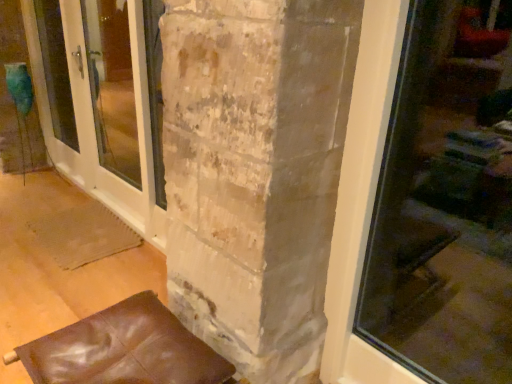
Question: In terms of height, does white glossy screen door at left look taller or shorter compared to leather cushion at lower left?

Choices:
 (A) tall
 (B) short

Answer: (A)

Question: Considering the positions of white glossy screen door at left and leather cushion at lower left in the image, is white glossy screen door at left bigger or smaller than leather cushion at lower left?

Choices:
 (A) big
 (B) small

Answer: (A)

Question: From a real-world perspective, is white glossy screen door at left above or below leather cushion at lower left?

Choices:
 (A) above
 (B) below

Answer: (A)

Question: In the image, is leather cushion at lower left positioned in front of or behind white glossy screen door at left?

Choices:
 (A) behind
 (B) front

Answer: (B)

Question: Which is correct: leather cushion at lower left is inside white glossy screen door at left, or outside of it?

Choices:
 (A) outside
 (B) inside

Answer: (A)

Question: From a real-world perspective, relative to white glossy screen door at left, is leather cushion at lower left vertically above or below?

Choices:
 (A) below
 (B) above

Answer: (A)

Question: Considering the positions of leather cushion at lower left and white glossy screen door at left in the image, is leather cushion at lower left bigger or smaller than white glossy screen door at left?

Choices:
 (A) small
 (B) big

Answer: (A)